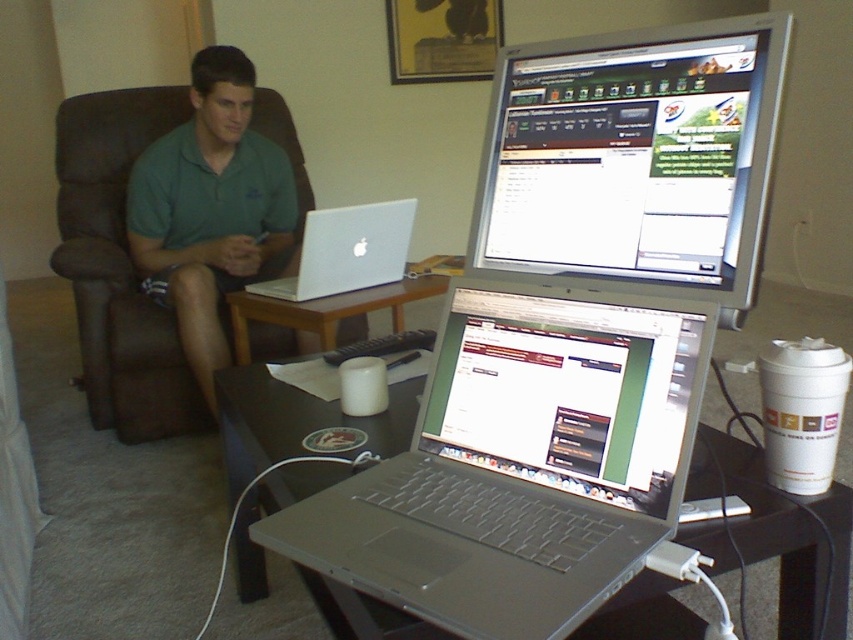
Question: Which point is closer to the camera?

Choices:
 (A) green cotton polo shirt at upper left
 (B) black glossy table at lower center
 (C) wooden table at center

Answer: (B)

Question: Is black glossy table at lower center smaller than silver metallic laptop at center?

Choices:
 (A) yes
 (B) no

Answer: (B)

Question: Is green cotton polo shirt at upper left bigger than wooden table at center?

Choices:
 (A) no
 (B) yes

Answer: (B)

Question: Is green cotton polo shirt at upper left positioned behind wooden table at center?

Choices:
 (A) yes
 (B) no

Answer: (A)

Question: Which of the following is the farthest from the observer?

Choices:
 (A) (260, 291)
 (B) (761, 490)
 (C) (590, 195)

Answer: (A)

Question: Which object appears farthest from the camera in this image?

Choices:
 (A) silver metallic laptop at center
 (B) green cotton polo shirt at upper left
 (C) wooden table at center

Answer: (B)